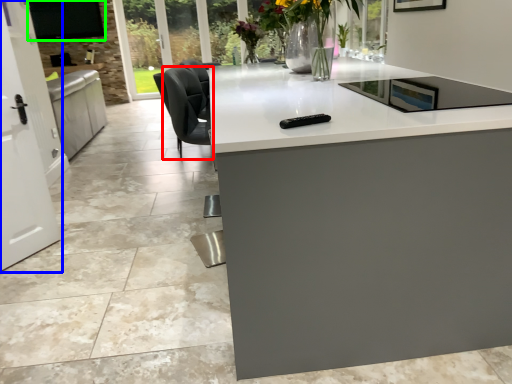
Question: Considering the real-world distances, which object is farthest from swivel chair (highlighted by a red box)? screen door (highlighted by a blue box) or window screen (highlighted by a green box)?

Choices:
 (A) screen door
 (B) window screen

Answer: (B)